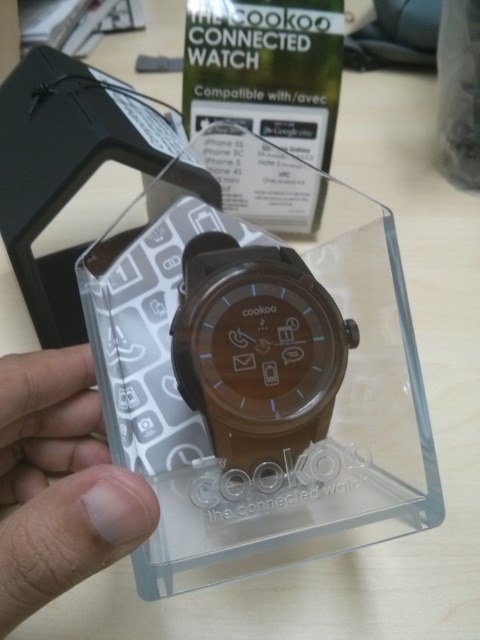
You are holding the packaging of the Cookoo Connected Watch and see the brown matte watch at center and the skinny white finger at lower left. Which object is located to the right of the other?

The brown matte watch at center is positioned on the right side of skinny white finger at lower left.

You are holding a camera and want to take a clear photo of the brown matte watch at center. The camera requires a minimum distance of 24 inches to focus properly. Can you take a clear photo from your current position?

The brown matte watch at center and camera are 22.96 inches apart from each other. Since the required minimum distance is 24 inches, you are too close to take a clear photo. Move back approximately 1 inch to meet the distance requirement.